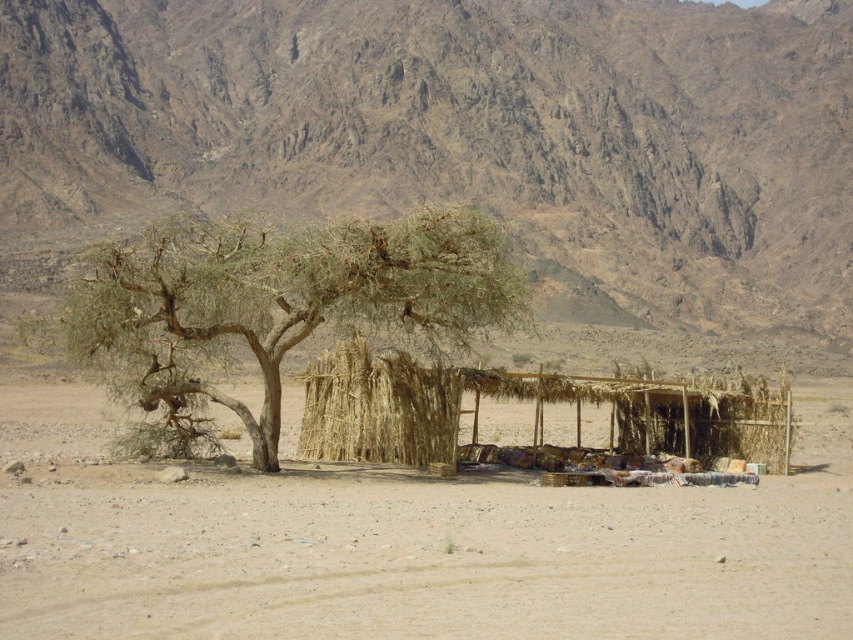
Is brown rocky mountain at upper center positioned behind brown sandy ground at center?

Yes, brown rocky mountain at upper center is behind brown sandy ground at center.

From the picture: Is brown rocky mountain at upper center closer to camera compared to brown sandy ground at center?

No, brown rocky mountain at upper center is further to the viewer.

Between point (474, 49) and point (805, 385), which one is positioned behind?

Positioned behind is point (474, 49).

Identify the location of brown rocky mountain at upper center. (463, 129).

Who is higher up, brown sandy ground at center or green leafy tree at center?

green leafy tree at center is higher up.

Is brown sandy ground at center smaller than green leafy tree at center?

No, brown sandy ground at center is not smaller than green leafy tree at center.

You are a GUI agent. You are given a task and a screenshot of the screen. Output one action in this format:
    pyautogui.click(x=<x>, y=<y>)
    Task: Click on the brown sandy ground at center
    The image size is (853, 640).
    Given the screenshot: What is the action you would take?
    pyautogui.click(x=431, y=552)

Is brown rocky mountain at upper center positioned in front of green leafy tree at center?

No, brown rocky mountain at upper center is behind green leafy tree at center.

Does brown rocky mountain at upper center have a greater height compared to green leafy tree at center?

Yes.

Does point (144, 120) come in front of point (119, 264)?

No, it is not.

Where is `brown rocky mountain at upper center`? brown rocky mountain at upper center is located at coordinates (463, 129).